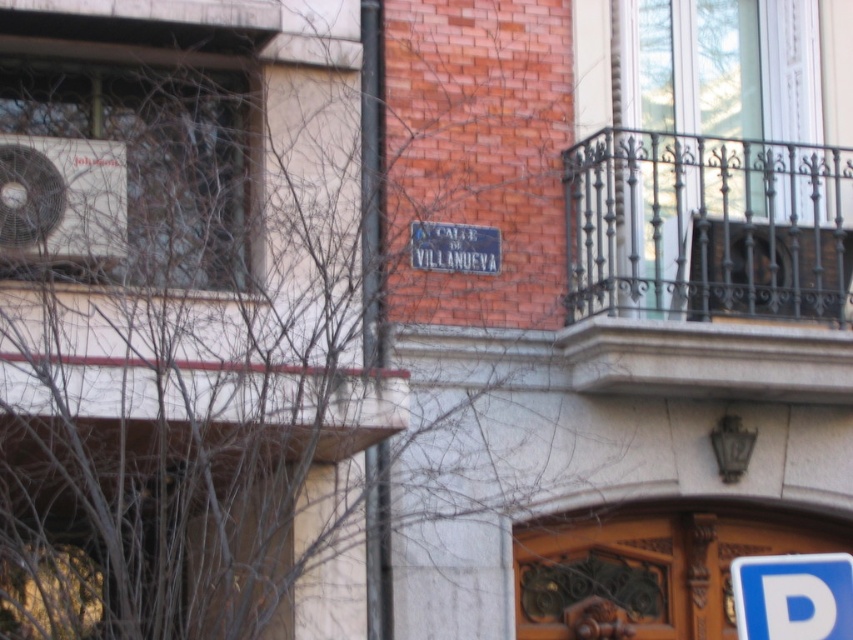
Is point (735, 173) positioned behind point (35, 221)?

Yes.

Does black wrought iron balcony at upper right have a lesser height compared to matte black air conditioner at upper left?

Incorrect, black wrought iron balcony at upper right's height does not fall short of matte black air conditioner at upper left's.

This screenshot has height=640, width=853. Identify the location of black wrought iron balcony at upper right. (712, 259).

What are the coordinates of `black wrought iron balcony at upper right` in the screenshot? It's located at (712, 259).

Between black wrought iron balcony at upper right and blue plastic parking sign at lower right, which one has more height?

black wrought iron balcony at upper right

This screenshot has height=640, width=853. I want to click on black wrought iron balcony at upper right, so tap(712, 259).

Between matte black air conditioner at upper left and blue plastic parking sign at lower right, which one has less height?

blue plastic parking sign at lower right

Is matte black air conditioner at upper left bigger than blue plastic parking sign at lower right?

Yes, matte black air conditioner at upper left is bigger than blue plastic parking sign at lower right.

Identify the location of matte black air conditioner at upper left. The image size is (853, 640). (61, 198).